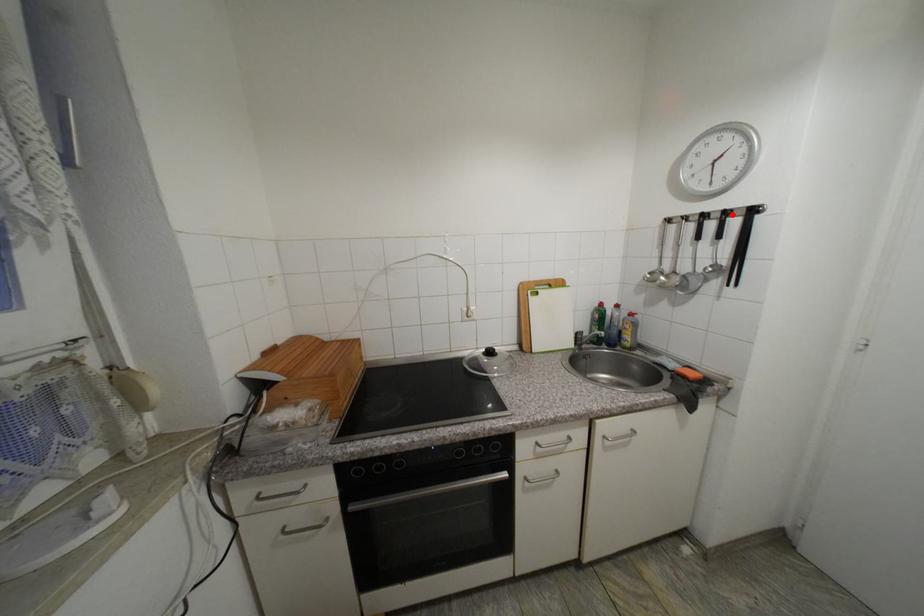
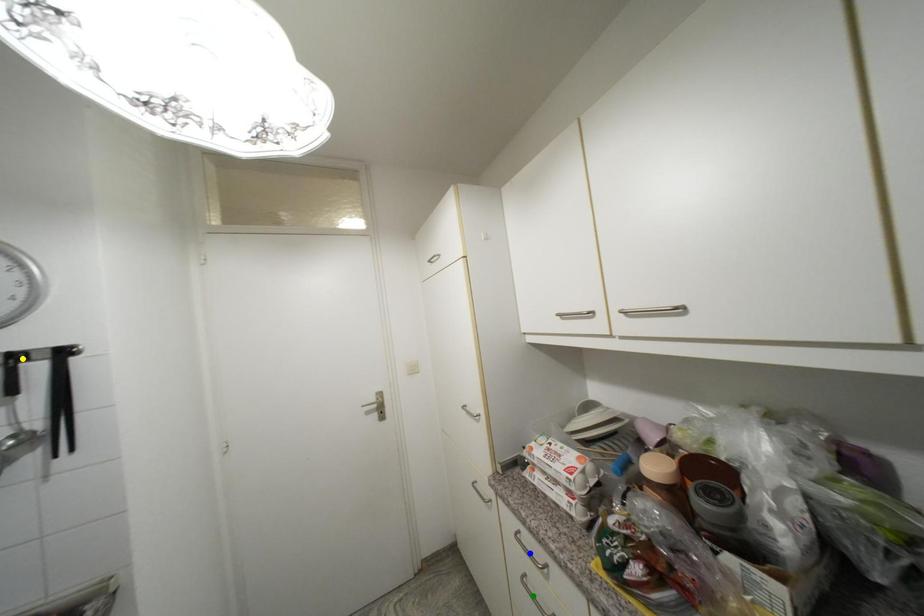
Question: I am providing you with two images of the same scene from different viewpoints. A red point is marked on the first image. You are given multiple points on the second image. Which mark in image 2 goes with the point in image 1?

Choices:
 (A) yellow point
 (B) green point
 (C) blue point

Answer: (A)